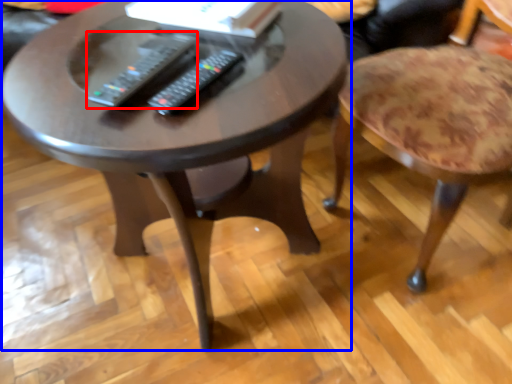
Question: Which object is closer to the camera taking this photo, remote (highlighted by a red box) or coffee table (highlighted by a blue box)?

Choices:
 (A) remote
 (B) coffee table

Answer: (B)